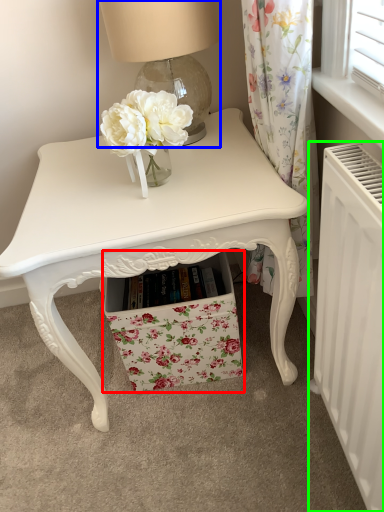
Question: Which object is the farthest from drawer (highlighted by a red box)? Choose among these: table lamp (highlighted by a blue box) or radiator (highlighted by a green box).

Choices:
 (A) table lamp
 (B) radiator

Answer: (A)